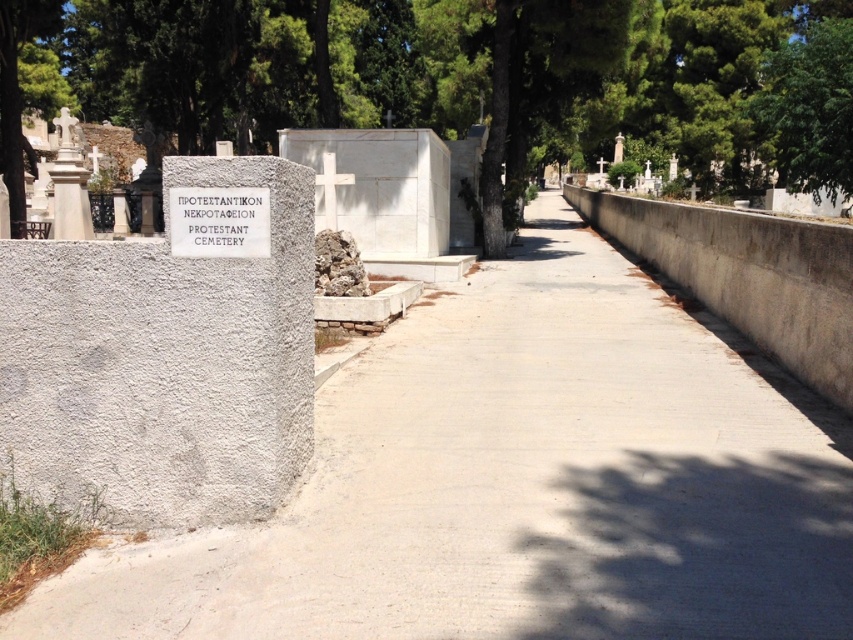
Question: Which object is closer to the camera taking this photo?

Choices:
 (A) green leafy tree at center
 (B) white marble statue at upper left
 (C) white concrete pavement at center

Answer: (C)

Question: Is white marble cross at center closer to the viewer compared to white marble statue at upper left?

Choices:
 (A) no
 (B) yes

Answer: (A)

Question: Which object is the closest to the white marble cross at center?

Choices:
 (A) white marble statue at upper left
 (B) green leafy tree at upper right

Answer: (A)

Question: In this image, where is green leafy tree at upper right located relative to white marble statue at upper left?

Choices:
 (A) below
 (B) above

Answer: (B)

Question: Where is white concrete pavement at center located in relation to white marble cross at center in the image?

Choices:
 (A) right
 (B) left

Answer: (A)

Question: Which of the following is the farthest from the observer?

Choices:
 (A) green leafy tree at upper right
 (B) green leafy tree at center
 (C) white concrete pavement at center

Answer: (A)